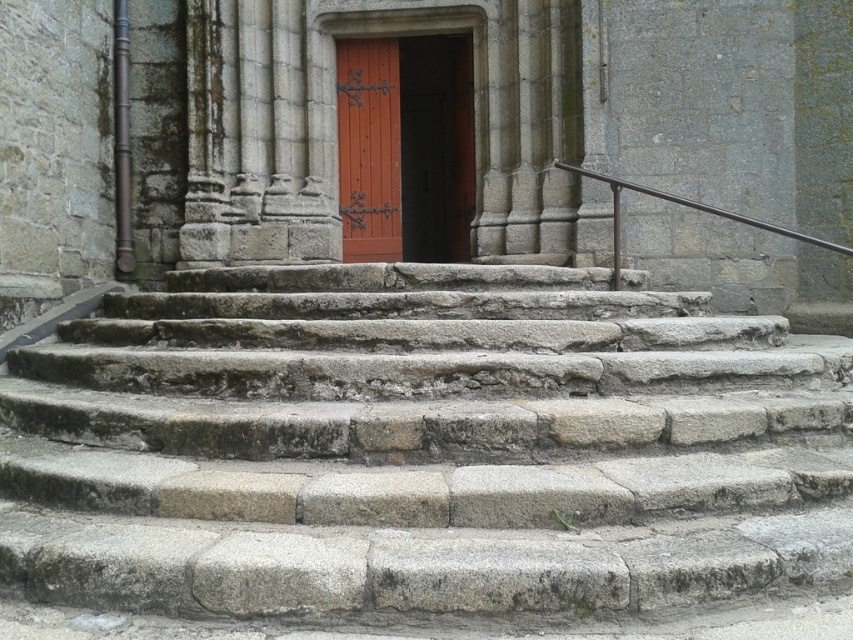
Question: Which point appears closest to the camera in this image?

Choices:
 (A) (343, 218)
 (B) (781, 445)

Answer: (B)

Question: Does smooth reddish-brown wooden door at center appear on the left side of black metal railing at upper right?

Choices:
 (A) no
 (B) yes

Answer: (B)

Question: Which object is positioned closest to the matte orange door at center?

Choices:
 (A) gray stone stairs at center
 (B) smooth reddish-brown wooden door at center
 (C) black metal railing at upper right

Answer: (B)

Question: Is gray stone stairs at center smaller than matte orange door at center?

Choices:
 (A) yes
 (B) no

Answer: (B)

Question: Is gray stone stairs at center to the left of matte orange door at center from the viewer's perspective?

Choices:
 (A) yes
 (B) no

Answer: (A)

Question: Which of the following is the farthest from the observer?

Choices:
 (A) smooth reddish-brown wooden door at center
 (B) gray stone stairs at center
 (C) matte orange door at center
 (D) black metal railing at upper right

Answer: (A)